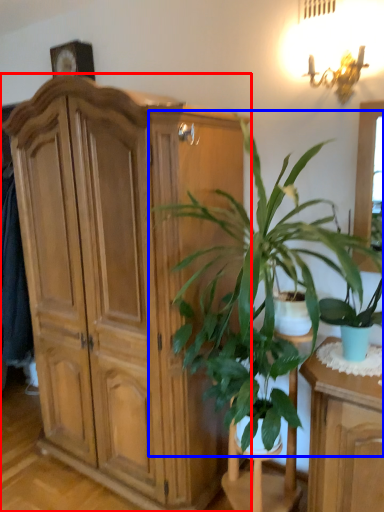
Question: Which of the following is the farthest to the observer, cabinetry (highlighted by a red box) or houseplant (highlighted by a blue box)?

Choices:
 (A) cabinetry
 (B) houseplant

Answer: (A)